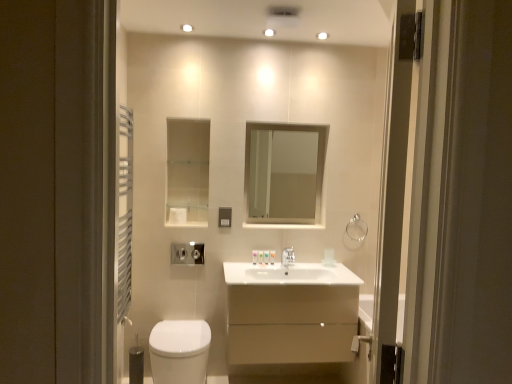
Question: From the image's perspective, is white glossy toiletries at center, which ranks as the fourth toiletry in left-to-right order, positioned above or below white glossy sink at center?

Choices:
 (A) below
 (B) above

Answer: (B)

Question: Is point (269, 251) positioned closer to the camera than point (254, 322)?

Choices:
 (A) farther
 (B) closer

Answer: (A)

Question: Estimate the real-world distances between objects in this image. Which object is closer to the clear glass towel bar at upper right?

Choices:
 (A) clear glass mirror at center
 (B) transparent glass screen door at right
 (C) white glossy sink at center
 (D) translucent plastic soap at center, which ranks as the second toiletry in right-to-left order
 (E) translucent plastic soap at center, the fourth toiletry positioned from the right

Answer: (D)

Question: Estimate the real-world distances between objects in this image. Which object is closer to the translucent plastic soap at center, the 1th toiletry when ordered from left to right?

Choices:
 (A) white glossy toilet at lower left
 (B) silver metallic faucet at center
 (C) clear glass mirror at center
 (D) white metal towel rack at left
 (E) clear glass towel bar at upper right

Answer: (B)